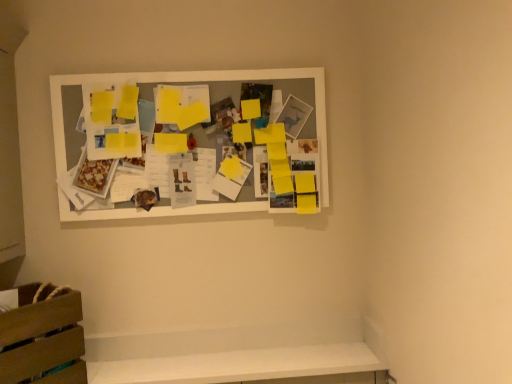
Describe the element at coordinates (196, 81) in the screenshot. I see `white matte picture frame at upper center` at that location.

The width and height of the screenshot is (512, 384). In order to click on white matte picture frame at upper center in this screenshot , I will do (x=196, y=81).

What is the approximate width of white matte picture frame at upper center?

white matte picture frame at upper center is 2.73 inches in width.

What do you see at coordinates (42, 336) in the screenshot? I see `wooden crate at lower left` at bounding box center [42, 336].

At what (x,y) coordinates should I click in order to perform the action: click on wooden crate at lower left. Please return your answer as a coordinate pair (x, y). The height and width of the screenshot is (384, 512). Looking at the image, I should click on (42, 336).

Find the location of `white matte picture frame at upper center`. white matte picture frame at upper center is located at coordinates (196, 81).

Considering the positions of objects white matte picture frame at upper center and wooden crate at lower left in the image provided, who is more to the left, white matte picture frame at upper center or wooden crate at lower left?

wooden crate at lower left.

Considering the relative positions of white matte picture frame at upper center and wooden crate at lower left in the image provided, is white matte picture frame at upper center behind wooden crate at lower left?

Yes, it is behind wooden crate at lower left.

Is point (172, 76) in front of point (29, 315)?

No, it is not.

From the image's perspective, which one is positioned higher, white matte picture frame at upper center or wooden crate at lower left?

From the image's view, white matte picture frame at upper center is above.

From a real-world perspective, is white matte picture frame at upper center above or below wooden crate at lower left?

Clearly, from a real-world perspective, white matte picture frame at upper center is above wooden crate at lower left.

Looking at their sizes, would you say white matte picture frame at upper center is wider or thinner than wooden crate at lower left?

Clearly, white matte picture frame at upper center has less width compared to wooden crate at lower left.

Does white matte picture frame at upper center have a greater height compared to wooden crate at lower left?

Yes, white matte picture frame at upper center is taller than wooden crate at lower left.

Who is bigger, white matte picture frame at upper center or wooden crate at lower left?

With larger size is white matte picture frame at upper center.

Choose the correct answer: Is white matte picture frame at upper center inside wooden crate at lower left or outside it?

white matte picture frame at upper center lies outside wooden crate at lower left.

Is white matte picture frame at upper center in contact with wooden crate at lower left?

white matte picture frame at upper center is not next to wooden crate at lower left, and they're not touching.

Consider the image. Is white matte picture frame at upper center oriented away from wooden crate at lower left?

No, white matte picture frame at upper center's orientation is not away from wooden crate at lower left.

What's the angular difference between white matte picture frame at upper center and wooden crate at lower left's facing directions?

white matte picture frame at upper center and wooden crate at lower left are facing 49.5 degrees away from each other.

At what (x,y) coordinates should I click in order to perform the action: click on furniture below the white matte picture frame at upper center (from a real-world perspective). Please return your answer as a coordinate pair (x, y). Looking at the image, I should click on (42, 336).

Can you confirm if wooden crate at lower left is positioned to the right of white matte picture frame at upper center?

Incorrect, wooden crate at lower left is not on the right side of white matte picture frame at upper center.

Considering their positions, is wooden crate at lower left located in front of or behind white matte picture frame at upper center?

In the image, wooden crate at lower left appears in front of white matte picture frame at upper center.

Which is closer to the camera, (76, 292) or (89, 217)?

Point (76, 292)

From the image's perspective, between wooden crate at lower left and white matte picture frame at upper center, who is located below?

From the image's view, wooden crate at lower left is below.

From a real-world perspective, is wooden crate at lower left located beneath white matte picture frame at upper center?

Yes, from a real-world perspective, wooden crate at lower left is under white matte picture frame at upper center.

Which object is wider, wooden crate at lower left or white matte picture frame at upper center?

wooden crate at lower left is wider.

Considering the relative sizes of wooden crate at lower left and white matte picture frame at upper center in the image provided, is wooden crate at lower left taller than white matte picture frame at upper center?

No, wooden crate at lower left is not taller than white matte picture frame at upper center.

Is wooden crate at lower left bigger than white matte picture frame at upper center?

No.

Would you say wooden crate at lower left is inside or outside white matte picture frame at upper center?

wooden crate at lower left is not inside white matte picture frame at upper center, it's outside.

Is wooden crate at lower left next to white matte picture frame at upper center?

wooden crate at lower left and white matte picture frame at upper center are clearly separated.

Is wooden crate at lower left positioned with its back to white matte picture frame at upper center?

No, wooden crate at lower left's orientation is not away from white matte picture frame at upper center.

How distant is wooden crate at lower left from white matte picture frame at upper center?

wooden crate at lower left is 20.39 inches from white matte picture frame at upper center.

Where is `picture frame above the wooden crate at lower left (from the image's perspective)`? The height and width of the screenshot is (384, 512). picture frame above the wooden crate at lower left (from the image's perspective) is located at coordinates (196, 81).

I want to click on furniture located underneath the white matte picture frame at upper center (from a real-world perspective), so click(x=42, y=336).

Identify the location of furniture below the white matte picture frame at upper center (from the image's perspective). pos(42,336).